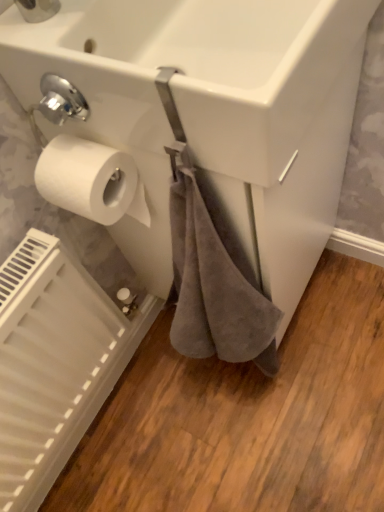
Question: Can you confirm if white matte radiator at lower left is bigger than white glossy sink at upper center?

Choices:
 (A) yes
 (B) no

Answer: (B)

Question: Is white matte radiator at lower left far away from white glossy sink at upper center?

Choices:
 (A) no
 (B) yes

Answer: (A)

Question: From a real-world perspective, is white matte radiator at lower left located higher than white glossy sink at upper center?

Choices:
 (A) yes
 (B) no

Answer: (B)

Question: Is white matte radiator at lower left looking in the opposite direction of white glossy sink at upper center?

Choices:
 (A) no
 (B) yes

Answer: (A)

Question: Could white glossy sink at upper center be considered to be inside white matte radiator at lower left?

Choices:
 (A) yes
 (B) no

Answer: (B)

Question: Is white matte radiator at lower left next to white glossy sink at upper center?

Choices:
 (A) no
 (B) yes

Answer: (A)

Question: Is white matte toilet paper at left smaller than white glossy sink at upper center?

Choices:
 (A) no
 (B) yes

Answer: (B)

Question: Considering the relative sizes of white matte toilet paper at left and white glossy sink at upper center in the image provided, is white matte toilet paper at left wider than white glossy sink at upper center?

Choices:
 (A) no
 (B) yes

Answer: (A)

Question: Considering the relative sizes of white matte toilet paper at left and white glossy sink at upper center in the image provided, is white matte toilet paper at left taller than white glossy sink at upper center?

Choices:
 (A) no
 (B) yes

Answer: (A)

Question: Can you confirm if white matte toilet paper at left is thinner than white glossy sink at upper center?

Choices:
 (A) no
 (B) yes

Answer: (B)

Question: From the image's perspective, does white matte toilet paper at left appear lower than white glossy sink at upper center?

Choices:
 (A) yes
 (B) no

Answer: (A)

Question: Is white matte toilet paper at left turned away from white glossy sink at upper center?

Choices:
 (A) yes
 (B) no

Answer: (A)

Question: Is white matte toilet paper at left bigger than white matte radiator at lower left?

Choices:
 (A) no
 (B) yes

Answer: (A)